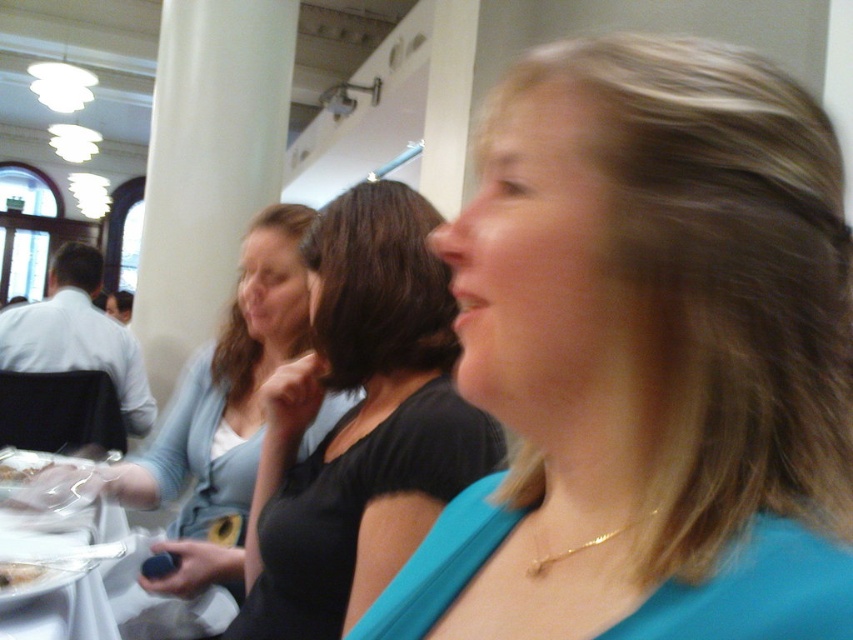
Question: Is blue fabric at center to the right of light blue sweater at center from the viewer's perspective?

Choices:
 (A) no
 (B) yes

Answer: (B)

Question: Can you confirm if blue fabric at center is bigger than light blue sweater at center?

Choices:
 (A) yes
 (B) no

Answer: (B)

Question: Among these objects, which one is nearest to the camera?

Choices:
 (A) white paper plate at lower left
 (B) light blue sweater at center

Answer: (A)

Question: Among these points, which one is nearest to the camera?

Choices:
 (A) pyautogui.click(x=93, y=637)
 (B) pyautogui.click(x=259, y=355)

Answer: (A)

Question: Does blue fabric at center lie in front of white plastic bag at lower left?

Choices:
 (A) yes
 (B) no

Answer: (A)

Question: Among these points, which one is farthest from the camera?

Choices:
 (A) (656, 465)
 (B) (3, 589)
 (C) (227, 506)
 (D) (73, 632)

Answer: (C)